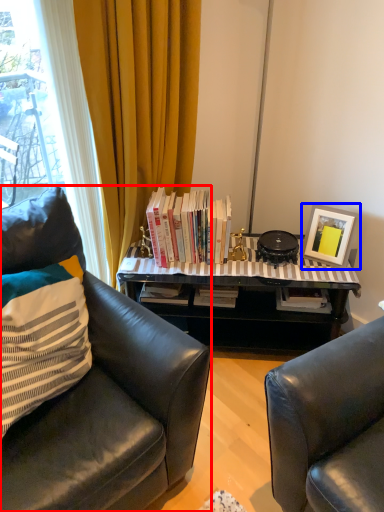
Question: Which of the following is the closest to the observer, chair (highlighted by a red box) or picture frame (highlighted by a blue box)?

Choices:
 (A) chair
 (B) picture frame

Answer: (A)